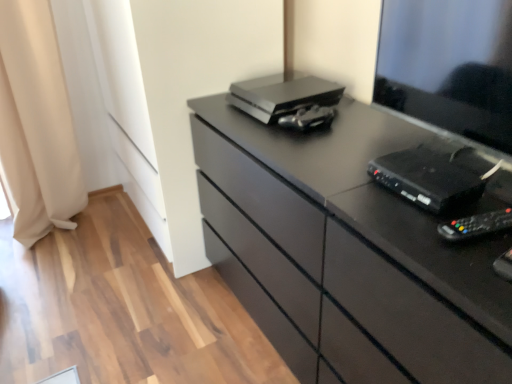
Find the location of a particular element. This screenshot has height=384, width=512. vacant space to the right of metallic silver game controller at center, which is the 3th equipment in front-to-back order is located at coordinates (367, 126).